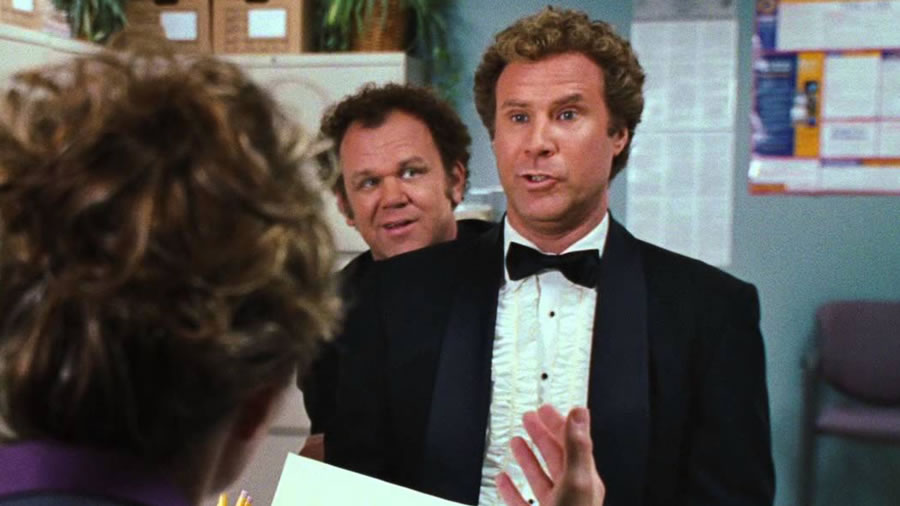
This screenshot has width=900, height=506. I want to click on office cabinets, so click(297, 81), click(27, 58).